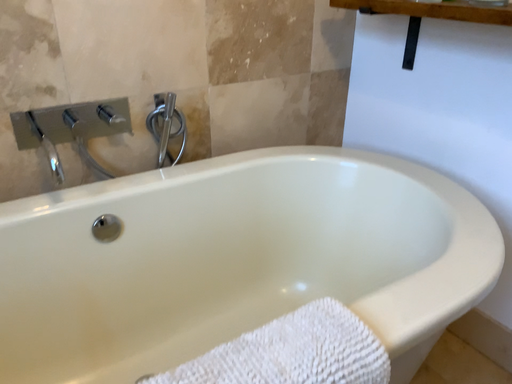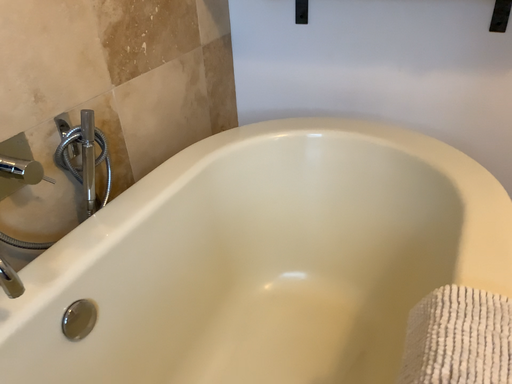
Question: How did the camera likely rotate when shooting the video?

Choices:
 (A) rotated left
 (B) rotated right

Answer: (B)